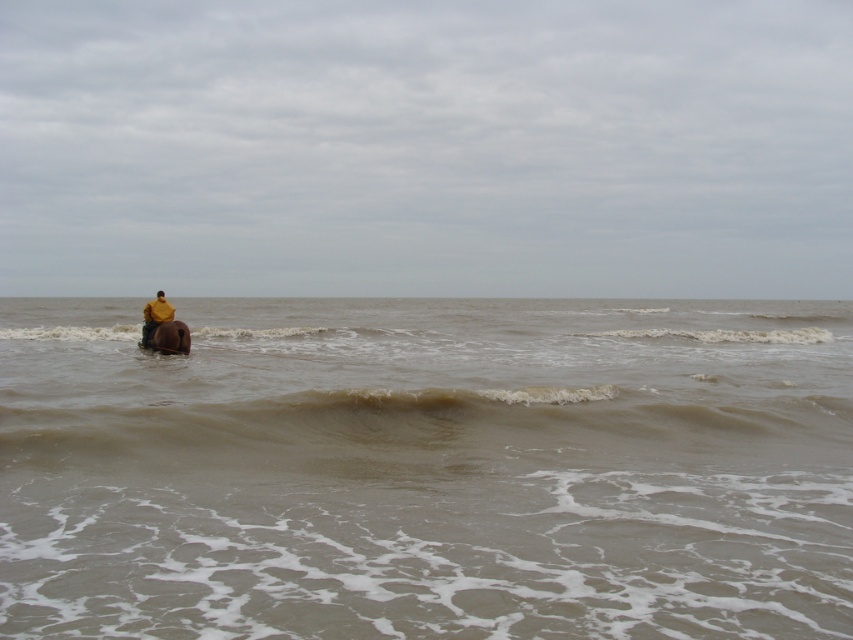
Does brown muddy water at left have a lesser height compared to brown matte horse at left?

Incorrect, brown muddy water at left's height does not fall short of brown matte horse at left's.

This screenshot has height=640, width=853. What do you see at coordinates (427, 468) in the screenshot?
I see `brown muddy water at left` at bounding box center [427, 468].

Image resolution: width=853 pixels, height=640 pixels. Find the location of `brown muddy water at left`. brown muddy water at left is located at coordinates (427, 468).

Where is `brown muddy water at left`? The height and width of the screenshot is (640, 853). brown muddy water at left is located at coordinates (427, 468).

Does point (512, 440) lie behind point (149, 304)?

No.

This screenshot has width=853, height=640. Find the location of `brown muddy water at left`. brown muddy water at left is located at coordinates (427, 468).

The image size is (853, 640). What do you see at coordinates (169, 337) in the screenshot?
I see `brown matte horse at left` at bounding box center [169, 337].

Does brown matte horse at left have a lesser height compared to yellow matte jacket at center?

Correct, brown matte horse at left is not as tall as yellow matte jacket at center.

At what (x,y) coordinates should I click in order to perform the action: click on brown matte horse at left. Please return your answer as a coordinate pair (x, y). Looking at the image, I should click on (169, 337).